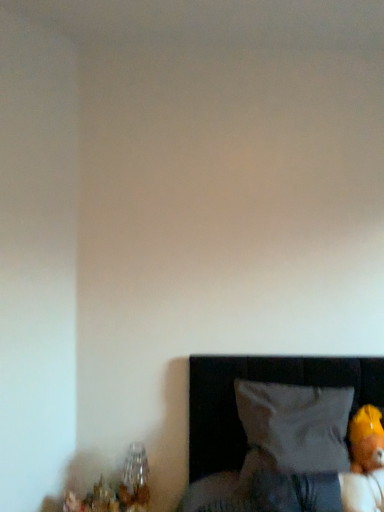
Question: Considering the positions of soft yellow plush bear at lower right and clear glass vase at lower left in the image, is soft yellow plush bear at lower right bigger or smaller than clear glass vase at lower left?

Choices:
 (A) big
 (B) small

Answer: (A)

Question: From the image's perspective, is soft yellow plush bear at lower right above or below clear glass vase at lower left?

Choices:
 (A) below
 (B) above

Answer: (B)

Question: Estimate the real-world distances between objects in this image. Which object is closer to the white fabric pillow at lower right?

Choices:
 (A) soft yellow plush bear at lower right
 (B) clear glass vase at lower left

Answer: (A)

Question: Based on their relative distances, which object is nearer to the soft yellow plush bear at lower right?

Choices:
 (A) white fabric pillow at lower right
 (B) clear glass vase at lower left

Answer: (A)